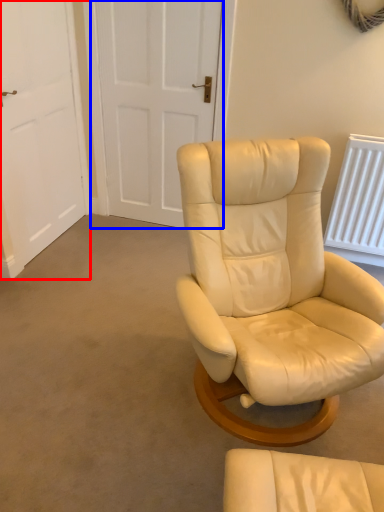
Question: Which of the following is the closest to the observer, door (highlighted by a red box) or door (highlighted by a blue box)?

Choices:
 (A) door
 (B) door

Answer: (A)